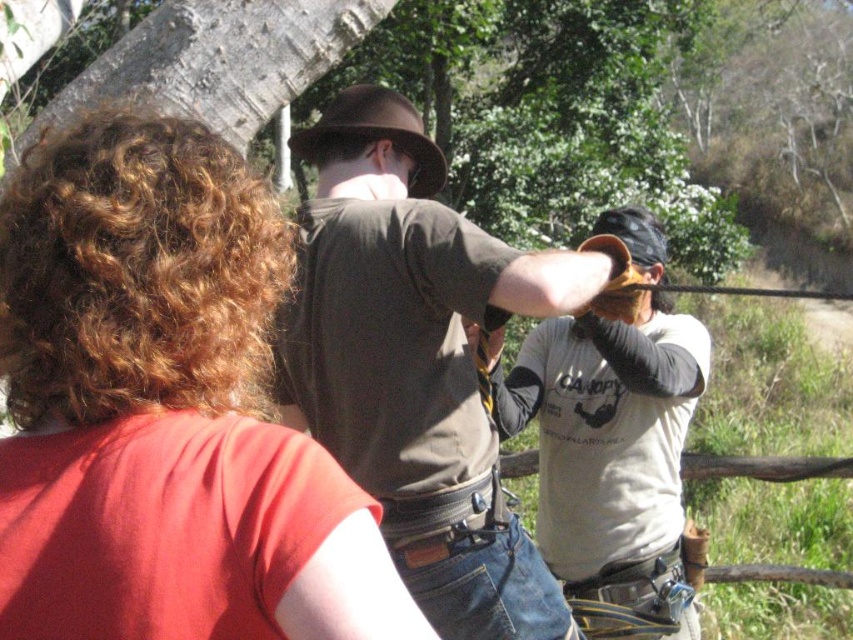
Question: Is matte red shirt at upper left behind matte brown shirt at center?

Choices:
 (A) yes
 (B) no

Answer: (B)

Question: Is matte red shirt at upper left thinner than matte brown shirt at center?

Choices:
 (A) no
 (B) yes

Answer: (B)

Question: Among these objects, which one is nearest to the camera?

Choices:
 (A) matte red shirt at upper left
 (B) matte brown shirt at center

Answer: (A)

Question: Which object appears farthest from the camera in this image?

Choices:
 (A) matte red shirt at upper left
 (B) matte brown shirt at center

Answer: (B)

Question: Is matte red shirt at upper left bigger than white cotton shirt at center?

Choices:
 (A) yes
 (B) no

Answer: (B)

Question: Among these points, which one is farthest from the camera?

Choices:
 (A) (381, 168)
 (B) (648, 468)

Answer: (B)